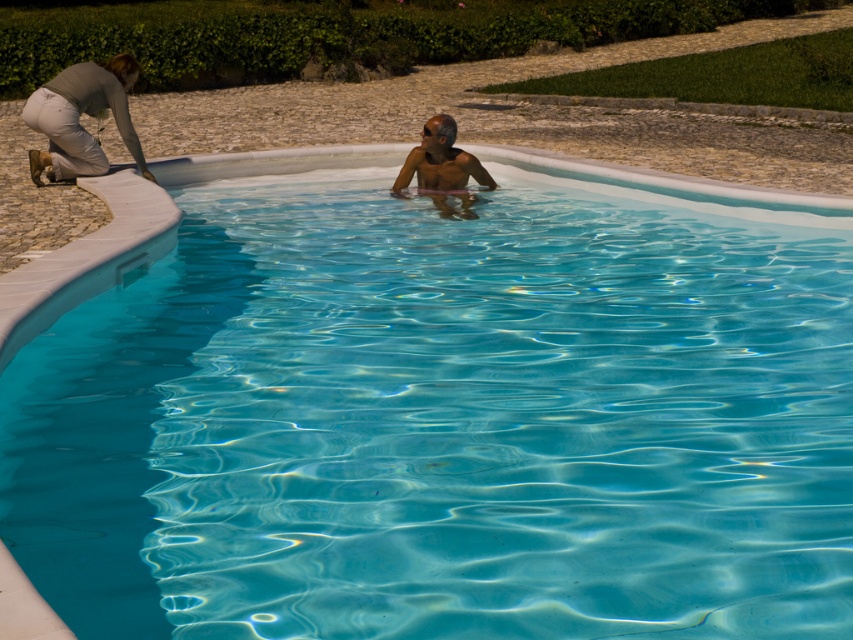
Looking at this image, is green leafy hedge at upper center closer to the viewer compared to smooth skin man at center?

No, it is not.

Does green leafy hedge at upper center have a lesser width compared to smooth skin man at center?

Incorrect, green leafy hedge at upper center's width is not less than smooth skin man at center's.

Image resolution: width=853 pixels, height=640 pixels. I want to click on green leafy hedge at upper center, so click(x=332, y=33).

The height and width of the screenshot is (640, 853). Identify the location of green leafy hedge at upper center. (332, 33).

Is point (62, 80) positioned in front of point (421, 134)?

Yes, point (62, 80) is closer to viewer.

Which is in front, point (103, 83) or point (491, 180)?

Point (103, 83) is more forward.

Locate an element on the screen. The height and width of the screenshot is (640, 853). light gray jeans at upper left is located at coordinates (78, 115).

Does green leafy hedge at upper center have a larger size compared to light gray jeans at upper left?

Yes, green leafy hedge at upper center is bigger than light gray jeans at upper left.

Between point (305, 60) and point (126, 86), which one is positioned in front?

Point (126, 86)

Locate an element on the screen. Image resolution: width=853 pixels, height=640 pixels. green leafy hedge at upper center is located at coordinates (332, 33).